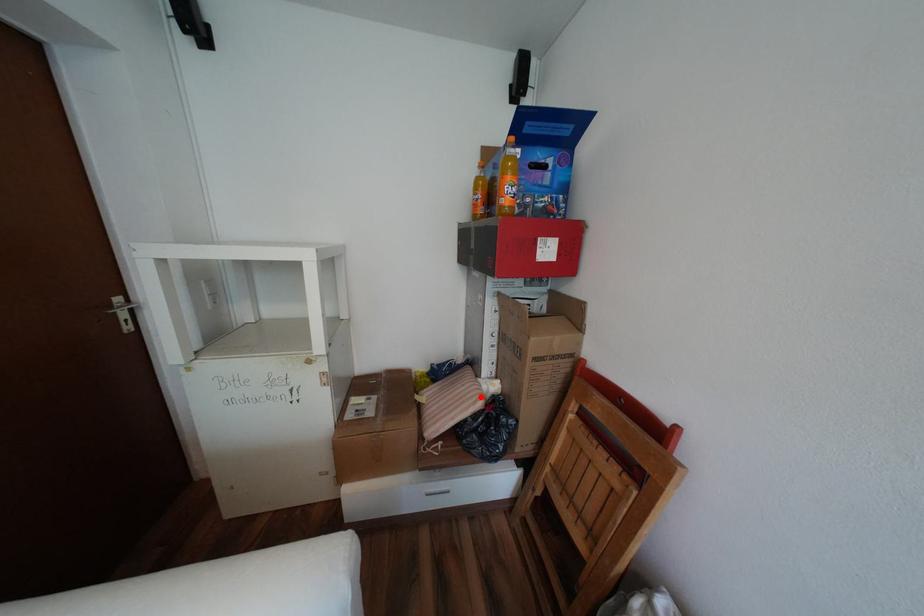
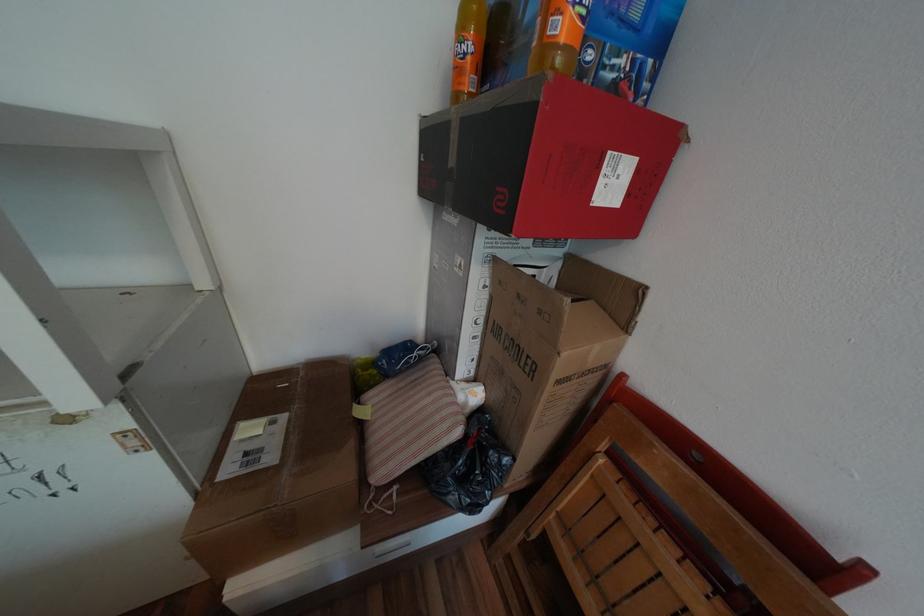
The point at the highlighted location is marked in the first image. Where is the corresponding point in the second image?

(453, 419)